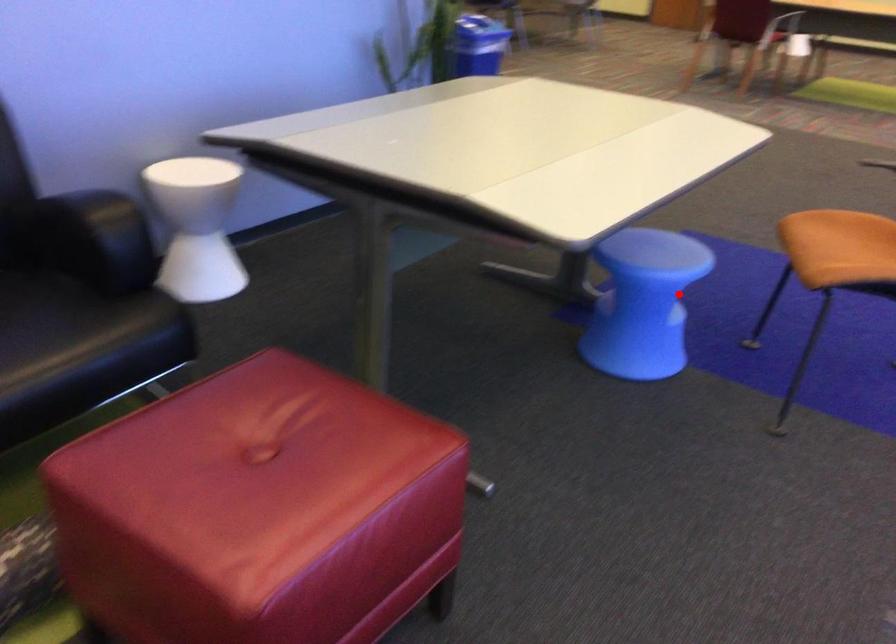
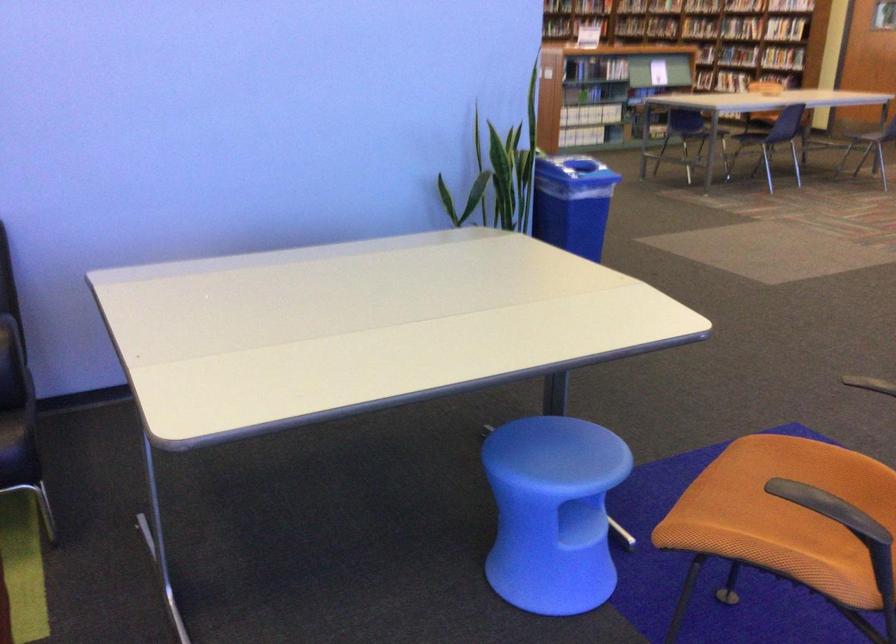
Question: I am providing you with two images of the same scene from different viewpoints. Given a red point in image1, look at the same physical point in image2. Is it:

Choices:
 (A) Closer to the viewpoint
 (B) Farther from the viewpoint

Answer: (A)